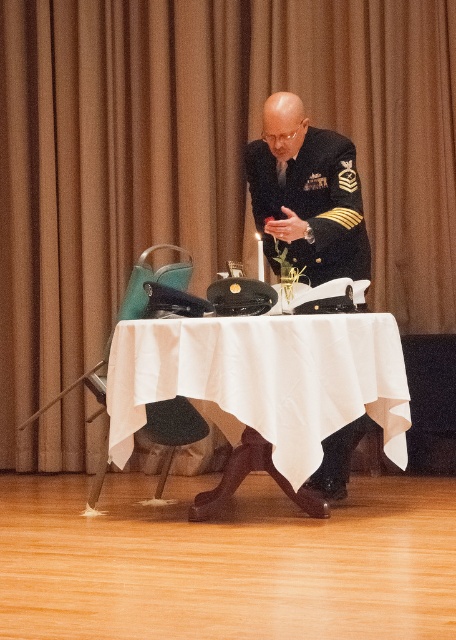
Question: Considering the relative positions of brown fabric curtain at upper center and black uniform at center in the image provided, where is brown fabric curtain at upper center located with respect to black uniform at center?

Choices:
 (A) right
 (B) left

Answer: (B)

Question: Is brown fabric curtain at upper center positioned at the back of black uniform at center?

Choices:
 (A) no
 (B) yes

Answer: (B)

Question: Can you confirm if white cloth-covered table at center is bigger than black uniform at center?

Choices:
 (A) yes
 (B) no

Answer: (A)

Question: Estimate the real-world distances between objects in this image. Which object is closer to the black uniform at center?

Choices:
 (A) white cloth-covered table at center
 (B) brown fabric curtain at upper center

Answer: (A)

Question: Which object is closer to the camera taking this photo?

Choices:
 (A) brown fabric curtain at upper center
 (B) white cloth-covered table at center

Answer: (B)

Question: Which is nearer to the brown fabric curtain at upper center?

Choices:
 (A) white cloth-covered table at center
 (B) black uniform at center

Answer: (B)